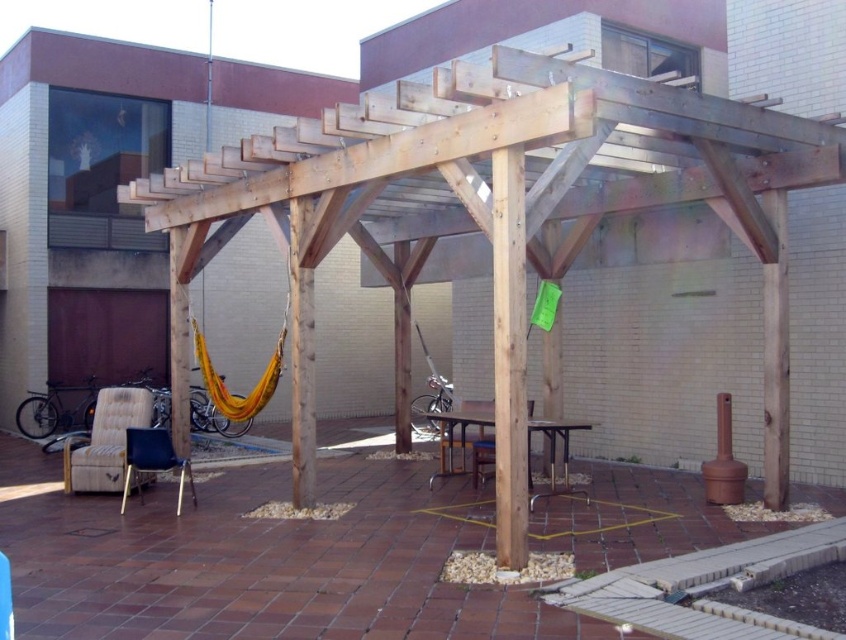
You are planning to set up a small garden on the patio. You have a potted plant that needs to be placed either on the beige fabric chair at lower left or the metallic gray chair at lower left. According to the scene description, which chair can support the potted plant better?

The metallic gray chair at lower left is located below the beige fabric chair at lower left, so the metallic gray chair at lower left is likely lower and might not be as stable for supporting the potted plant. The beige fabric chair at lower left is positioned above it and may be more elevated, making it a better choice for placing the potted plant.

You are a guest at this patio and want to sit down. You prefer a higher seat to enjoy the view. Which chair between the metallic gray chair at lower left and wooden chair at center should you choose?

The metallic gray chair at lower left has a greater height compared to the wooden chair at center, so you should choose the metallic gray chair at lower left to enjoy the view.